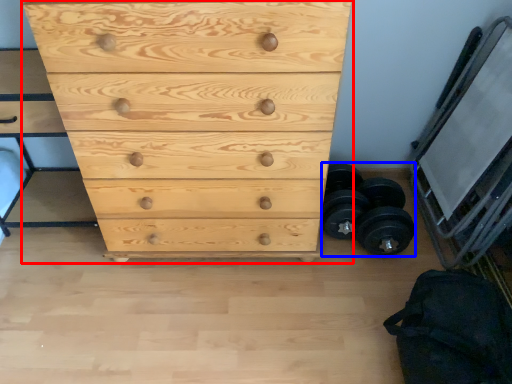
Question: Which object is further to the camera taking this photo, chest of drawers (highlighted by a red box) or dumbbell (highlighted by a blue box)?

Choices:
 (A) chest of drawers
 (B) dumbbell

Answer: (B)